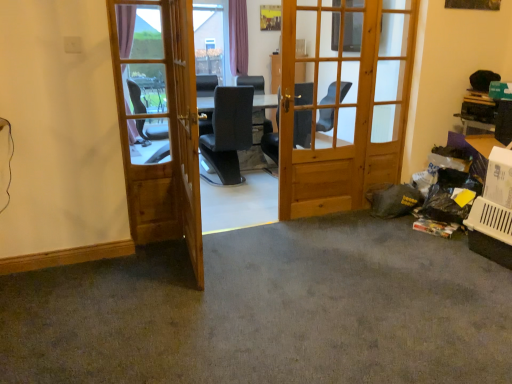
Question: Is wooden door at left, placed as the 1th door when sorted from left to right, positioned in front of light brown wooden screen door at center?

Choices:
 (A) no
 (B) yes

Answer: (A)

Question: Is wooden door at left, the second door positioned from the right, looking in the opposite direction of light brown wooden screen door at center?

Choices:
 (A) yes
 (B) no

Answer: (B)

Question: From a real-world perspective, is wooden door at left, placed as the 1th door when sorted from left to right, under light brown wooden screen door at center?

Choices:
 (A) no
 (B) yes

Answer: (A)

Question: Considering the relative sizes of wooden door at left, placed as the 1th door when sorted from left to right, and light brown wooden screen door at center in the image provided, is wooden door at left, placed as the 1th door when sorted from left to right, wider than light brown wooden screen door at center?

Choices:
 (A) no
 (B) yes

Answer: (A)

Question: Considering the relative sizes of wooden door at left, the second door positioned from the right, and light brown wooden screen door at center in the image provided, is wooden door at left, the second door positioned from the right, smaller than light brown wooden screen door at center?

Choices:
 (A) yes
 (B) no

Answer: (A)

Question: From the image's perspective, is gray carpet at lower right located above or below wooden door at left, the second door positioned from the right?

Choices:
 (A) above
 (B) below

Answer: (B)

Question: From a real-world perspective, is gray carpet at lower right above or below wooden door at left, placed as the 1th door when sorted from left to right?

Choices:
 (A) below
 (B) above

Answer: (A)

Question: Is gray carpet at lower right taller or shorter than wooden door at left, the second door positioned from the right?

Choices:
 (A) tall
 (B) short

Answer: (B)

Question: Would you say gray carpet at lower right is inside or outside wooden door at left, the second door positioned from the right?

Choices:
 (A) outside
 (B) inside

Answer: (A)

Question: Is wooden door at center, which ranks as the 1th door in right-to-left order, in front of or behind light brown wooden screen door at center in the image?

Choices:
 (A) behind
 (B) front

Answer: (A)

Question: Considering the positions of wooden door at center, which ranks as the 1th door in right-to-left order, and light brown wooden screen door at center in the image, is wooden door at center, which ranks as the 1th door in right-to-left order, taller or shorter than light brown wooden screen door at center?

Choices:
 (A) tall
 (B) short

Answer: (A)

Question: Do you think wooden door at center, the second door when ordered from left to right, is within light brown wooden screen door at center, or outside of it?

Choices:
 (A) outside
 (B) inside

Answer: (A)

Question: Looking at their shapes, would you say wooden door at center, the second door when ordered from left to right, is wider or thinner than light brown wooden screen door at center?

Choices:
 (A) wide
 (B) thin

Answer: (A)

Question: Is gray carpet at lower right wider or thinner than light brown wooden screen door at center?

Choices:
 (A) thin
 (B) wide

Answer: (B)

Question: Based on their positions, is gray carpet at lower right located to the left or right of light brown wooden screen door at center?

Choices:
 (A) right
 (B) left

Answer: (A)